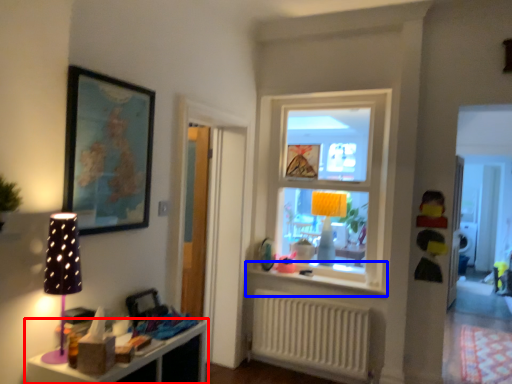
Question: Among these objects, which one is nearest to the camera, shelf (highlighted by a red box) or window sill (highlighted by a blue box)?

Choices:
 (A) shelf
 (B) window sill

Answer: (A)